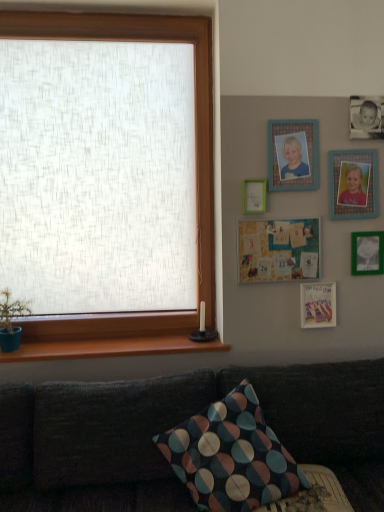
Question: From a real-world perspective, is dark fabric couch at lower left on top of multicolored fabric pillow at lower center?

Choices:
 (A) no
 (B) yes

Answer: (A)

Question: Could you tell me if dark fabric couch at lower left is facing multicolored fabric pillow at lower center?

Choices:
 (A) no
 (B) yes

Answer: (A)

Question: Considering the relative positions of dark fabric couch at lower left and multicolored fabric pillow at lower center in the image provided, is dark fabric couch at lower left behind multicolored fabric pillow at lower center?

Choices:
 (A) yes
 (B) no

Answer: (B)

Question: Is dark fabric couch at lower left with multicolored fabric pillow at lower center?

Choices:
 (A) no
 (B) yes

Answer: (A)

Question: Considering the relative sizes of dark fabric couch at lower left and multicolored fabric pillow at lower center in the image provided, is dark fabric couch at lower left bigger than multicolored fabric pillow at lower center?

Choices:
 (A) no
 (B) yes

Answer: (B)

Question: Is point (269, 252) closer or farther from the camera than point (213, 379)?

Choices:
 (A) farther
 (B) closer

Answer: (A)

Question: Considering the relative positions of wooden bulletin board at upper right, acting as the third picture frame starting from the bottom, and dark fabric couch at lower left in the image provided, is wooden bulletin board at upper right, acting as the third picture frame starting from the bottom, to the left or to the right of dark fabric couch at lower left?

Choices:
 (A) right
 (B) left

Answer: (A)

Question: Looking at their shapes, would you say wooden bulletin board at upper right, placed as the 4th picture frame when sorted from top to bottom, is wider or thinner than dark fabric couch at lower left?

Choices:
 (A) thin
 (B) wide

Answer: (A)

Question: Choose the correct answer: Is wooden bulletin board at upper right, placed as the 4th picture frame when sorted from top to bottom, inside dark fabric couch at lower left or outside it?

Choices:
 (A) inside
 (B) outside

Answer: (B)

Question: Considering their positions, is green matte plant at lower left located in front of or behind dark fabric couch at lower left?

Choices:
 (A) behind
 (B) front

Answer: (A)

Question: In the image, is green matte plant at lower left on the left side or the right side of dark fabric couch at lower left?

Choices:
 (A) right
 (B) left

Answer: (B)

Question: From the image's perspective, is green matte plant at lower left positioned above or below dark fabric couch at lower left?

Choices:
 (A) above
 (B) below

Answer: (A)

Question: From a real-world perspective, is green matte plant at lower left physically located above or below dark fabric couch at lower left?

Choices:
 (A) below
 (B) above

Answer: (B)

Question: Is point (284, 273) closer or farther from the camera than point (248, 380)?

Choices:
 (A) farther
 (B) closer

Answer: (A)

Question: From the image's perspective, is wooden bulletin board at upper right, placed as the 4th picture frame when sorted from top to bottom, above or below multicolored fabric pillow at lower center?

Choices:
 (A) above
 (B) below

Answer: (A)